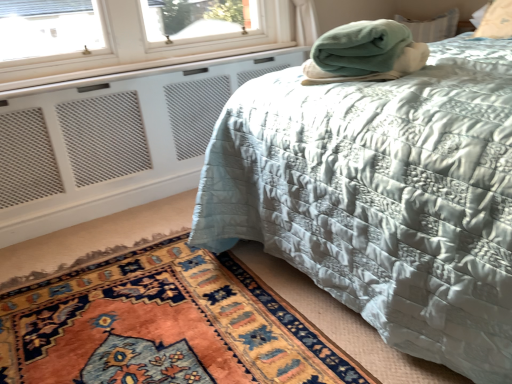
Describe the element at coordinates (364, 53) in the screenshot. The height and width of the screenshot is (384, 512). I see `green fleece blanket at upper right` at that location.

This screenshot has height=384, width=512. Identify the location of white mesh radiator at lower left. (112, 143).

The image size is (512, 384). Describe the element at coordinates (164, 326) in the screenshot. I see `carpeted rug at lower left` at that location.

At what (x,y) coordinates should I click in order to perform the action: click on green fleece blanket at upper right. Please return your answer as a coordinate pair (x, y). The height and width of the screenshot is (384, 512). Looking at the image, I should click on (364, 53).

Can silky blue quilt at center be found inside green fleece blanket at upper right?

No, green fleece blanket at upper right does not contain silky blue quilt at center.

Find the location of a particular element. bed on the right of green fleece blanket at upper right is located at coordinates (382, 197).

Which object is further away from the camera, green fleece blanket at upper right or silky blue quilt at center?

green fleece blanket at upper right is further from the camera.

Can carpeted rug at lower left be found inside green fleece blanket at upper right?

Definitely not — carpeted rug at lower left is not inside green fleece blanket at upper right.

Between green fleece blanket at upper right and carpeted rug at lower left, which one is positioned behind?

green fleece blanket at upper right is further from the camera.

Between green fleece blanket at upper right and carpeted rug at lower left, which one appears on the left side from the viewer's perspective?

carpeted rug at lower left is more to the left.

Can you tell me how much green fleece blanket at upper right and carpeted rug at lower left differ in facing direction?

The angle between the facing direction of green fleece blanket at upper right and the facing direction of carpeted rug at lower left is 33.2 degrees.

From the image's perspective, which is below, silky blue quilt at center or green fleece blanket at upper right?

From the image's view, silky blue quilt at center is below.

Which object is further away from the camera, silky blue quilt at center or green fleece blanket at upper right?

green fleece blanket at upper right.

From a real-world perspective, does silky blue quilt at center stand above green fleece blanket at upper right?

No, from a real-world perspective, silky blue quilt at center is not on top of green fleece blanket at upper right.

Is silky blue quilt at center situated inside green fleece blanket at upper right or outside?

The correct answer is: outside.

Does carpeted rug at lower left have a lesser width compared to silky blue quilt at center?

Indeed, carpeted rug at lower left has a lesser width compared to silky blue quilt at center.

In the scene shown: Who is more distant, carpeted rug at lower left or silky blue quilt at center?

carpeted rug at lower left is more distant.

Consider the image. Is carpeted rug at lower left facing towards silky blue quilt at center?

No, carpeted rug at lower left does not turn towards silky blue quilt at center.

In the scene shown: From the image's perspective, relative to silky blue quilt at center, is carpeted rug at lower left above or below?

From the image's perspective, carpeted rug at lower left appears below silky blue quilt at center.

Locate an element on the screen. This screenshot has width=512, height=384. radiator on the left side of carpeted rug at lower left is located at coordinates (112, 143).

Which of these two, carpeted rug at lower left or white mesh radiator at lower left, is smaller?

With smaller size is carpeted rug at lower left.

From a real-world perspective, is carpeted rug at lower left beneath white mesh radiator at lower left?

Yes, from a real-world perspective, carpeted rug at lower left is under white mesh radiator at lower left.

From the picture: Is carpeted rug at lower left situated inside white mesh radiator at lower left or outside?

carpeted rug at lower left is not enclosed by white mesh radiator at lower left.

Which is correct: silky blue quilt at center is inside carpeted rug at lower left, or outside of it?

silky blue quilt at center is located beyond the bounds of carpeted rug at lower left.

Is silky blue quilt at center turned away from carpeted rug at lower left?

No.

Looking at this image, does silky blue quilt at center have a smaller size compared to carpeted rug at lower left?

No.

Which point is more forward, (x=402, y=297) or (x=254, y=378)?

Positioned in front is point (x=402, y=297).

Considering the positions of points (255, 173) and (164, 161), is point (255, 173) farther from camera compared to point (164, 161)?

No.

From the image's perspective, which is below, silky blue quilt at center or white mesh radiator at lower left?

white mesh radiator at lower left, from the image's perspective.

Does silky blue quilt at center have a greater width compared to white mesh radiator at lower left?

Yes, silky blue quilt at center is wider than white mesh radiator at lower left.

Is white mesh radiator at lower left at the back of silky blue quilt at center?

No, white mesh radiator at lower left is not at the back of silky blue quilt at center.

You are a GUI agent. You are given a task and a screenshot of the screen. Output one action in this format:
    pyautogui.click(x=<x>, y=<y>)
    Task: Click on the bed lying below the green fleece blanket at upper right (from the image's perspective)
    This screenshot has width=512, height=384.
    Given the screenshot: What is the action you would take?
    pyautogui.click(x=382, y=197)

Find the location of a particular element. The image size is (512, 384). blanket lying behind the carpeted rug at lower left is located at coordinates (364, 53).

Considering their positions, is white mesh radiator at lower left positioned closer to green fleece blanket at upper right than carpeted rug at lower left?

The object closer to green fleece blanket at upper right is carpeted rug at lower left.

Looking at the image, which one is located closer to silky blue quilt at center, carpeted rug at lower left or white mesh radiator at lower left?

Based on the image, carpeted rug at lower left appears to be nearer to silky blue quilt at center.

Considering their positions, is carpeted rug at lower left positioned closer to green fleece blanket at upper right than silky blue quilt at center?

Based on the image, silky blue quilt at center appears to be nearer to green fleece blanket at upper right.

Looking at the image, which one is located closer to green fleece blanket at upper right, silky blue quilt at center or carpeted rug at lower left?

silky blue quilt at center is closer to green fleece blanket at upper right.

Which object lies further to the anchor point silky blue quilt at center, green fleece blanket at upper right or white mesh radiator at lower left?

white mesh radiator at lower left lies further to silky blue quilt at center than the other object.

Based on the photo, based on their spatial positions, is silky blue quilt at center or green fleece blanket at upper right further from white mesh radiator at lower left?

green fleece blanket at upper right lies further to white mesh radiator at lower left than the other object.

Looking at the image, which one is located further to silky blue quilt at center, white mesh radiator at lower left or green fleece blanket at upper right?

Based on the image, white mesh radiator at lower left appears to be further to silky blue quilt at center.

Which object lies nearer to the anchor point silky blue quilt at center, green fleece blanket at upper right or carpeted rug at lower left?

green fleece blanket at upper right is closer to silky blue quilt at center.

I want to click on mat between white mesh radiator at lower left and silky blue quilt at center, so click(x=164, y=326).

I want to click on blanket situated between white mesh radiator at lower left and silky blue quilt at center from left to right, so click(364, 53).

You are a GUI agent. You are given a task and a screenshot of the screen. Output one action in this format:
    pyautogui.click(x=<x>, y=<y>)
    Task: Click on the blanket situated between carpeted rug at lower left and silky blue quilt at center from left to right
    
    Given the screenshot: What is the action you would take?
    pyautogui.click(x=364, y=53)

The image size is (512, 384). I want to click on blanket between carpeted rug at lower left and white mesh radiator at lower left along the z-axis, so click(364, 53).